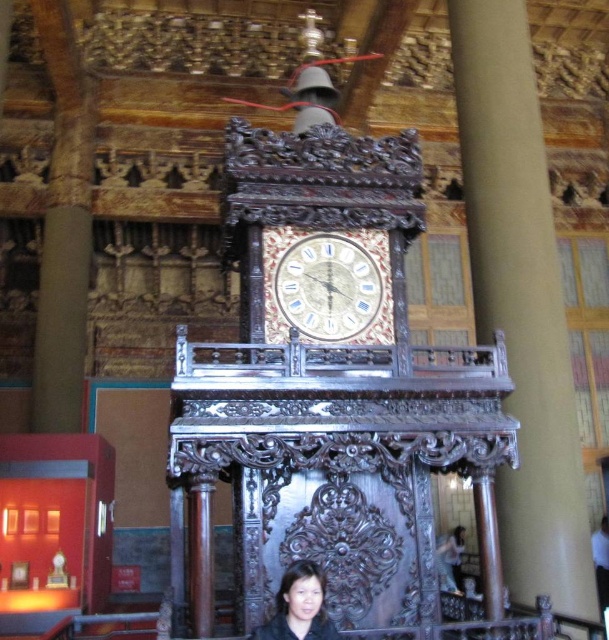
Question: Which object is farther from the camera taking this photo?

Choices:
 (A) gold textured clock at center
 (B) smooth beige shirt at lower right
 (C) smooth black hair at lower center
 (D) brown polished wood pillar at center

Answer: (B)

Question: Which object appears farthest from the camera in this image?

Choices:
 (A) gold textured clock at center
 (B) brown polished wood pillar at center
 (C) smooth black hair at lower center

Answer: (A)

Question: Does smooth black hair at lower center appear under smooth beige shirt at lower right?

Choices:
 (A) no
 (B) yes

Answer: (A)

Question: Which of the following is the closest to the observer?

Choices:
 (A) (607, 548)
 (B) (312, 273)

Answer: (B)

Question: Does gold textured clock at center have a larger size compared to smooth black hair at lower center?

Choices:
 (A) no
 (B) yes

Answer: (B)

Question: Can you confirm if brown polished wood pillar at center is wider than smooth black hair at lower center?

Choices:
 (A) no
 (B) yes

Answer: (B)